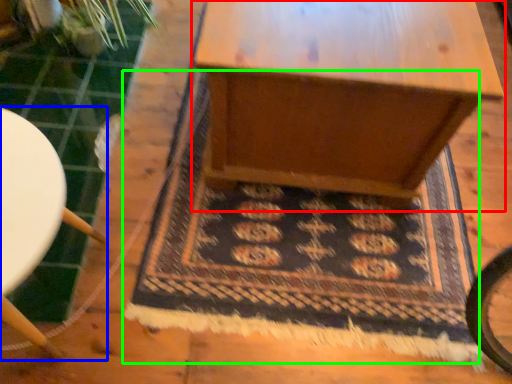
Question: Estimate the real-world distances between objects in this image. Which object is farther from table (highlighted by a red box), furniture (highlighted by a blue box) or mat (highlighted by a green box)?

Choices:
 (A) furniture
 (B) mat

Answer: (A)